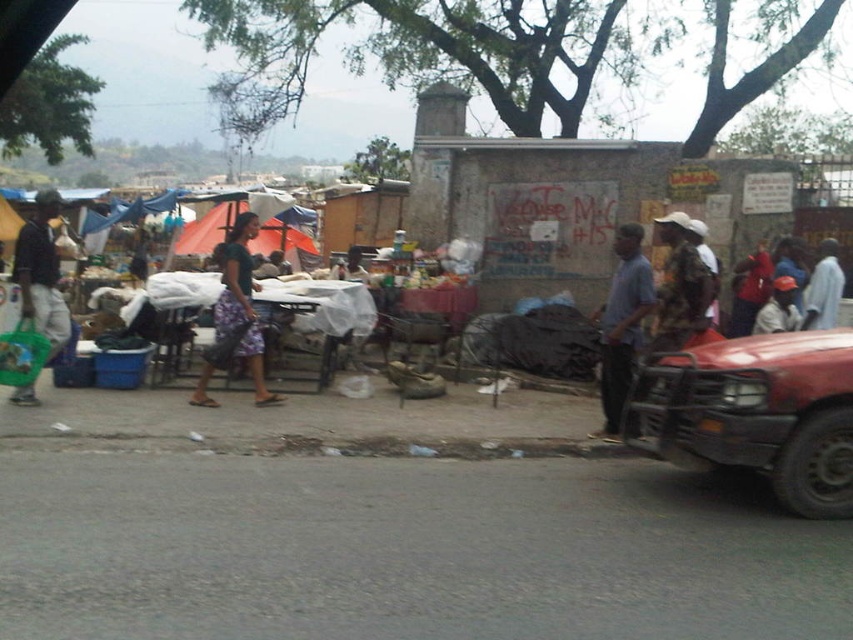
You are standing at the origin point in the image. A shiny red truck is located at point (759, 413). Which direction should you move to reach the shiny red truck?

The shiny red truck is located at point (759, 413), so you should move towards the right side of the image to reach it.

You are a delivery person needing to park your van next to the shiny red truck at right and the blue fabric at center. Which object should you position your van closer to if you want to maximize space for unloading?

You should position your van closer to the blue fabric at center because the shiny red truck at right is wider than the blue fabric at center, leaving more space near the narrower blue fabric at center for unloading.

Looking at this image, you are standing at the origin of the coordinate system in the image. Which point is closer to you, point (804, 328) or point (751, 268)?

Point (804, 328) is in front of point (751, 268), so it is closer to you.